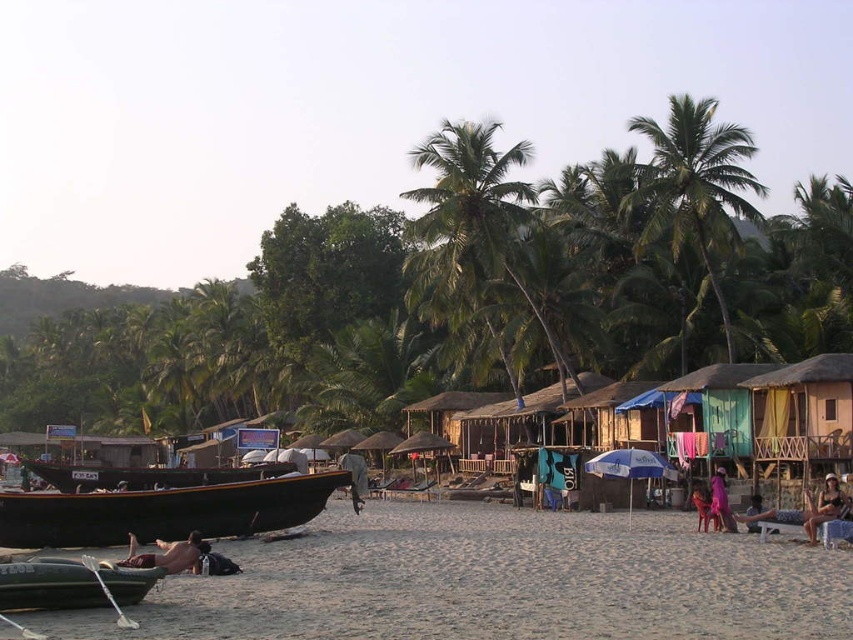
You are a photographer standing on the beach and want to take a picture of the dark brown wooden boat at lower left and the beige fabric chair at lower right. Which object is closer to the left edge of your camera frame?

The dark brown wooden boat at lower left is positioned on the left side of beige fabric chair at lower right, so it will be closer to the left edge of the camera frame.

You are standing on the beach and want to walk towards both the point at coordinates point (816, 500) and the point at coordinates point (705, 508). Which point will you reach first?

You will reach point (816, 500) first because it is closer to you than point (705, 508), which is further away.